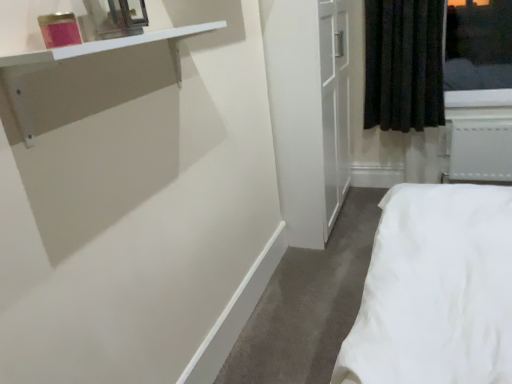
Question: Is white glossy shelf at upper left taller or shorter than metallic mirror at upper left?

Choices:
 (A) short
 (B) tall

Answer: (A)

Question: Considering the positions of white glossy shelf at upper left and metallic mirror at upper left in the image, is white glossy shelf at upper left wider or thinner than metallic mirror at upper left?

Choices:
 (A) thin
 (B) wide

Answer: (B)

Question: Which object is the farthest from the white plastic radiator at lower right?

Choices:
 (A) metallic mirror at upper left
 (B) white glossy shelf at upper left
 (C) black fabric curtain at upper right

Answer: (A)

Question: Estimate the real-world distances between objects in this image. Which object is closer to the white glossy shelf at upper left?

Choices:
 (A) metallic mirror at upper left
 (B) black fabric curtain at upper right
 (C) white plastic radiator at lower right

Answer: (A)